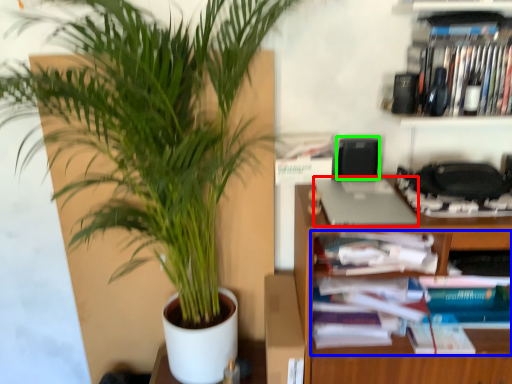
Question: Considering the real-world distances, which object is farthest from laptop (highlighted by a red box)? book (highlighted by a blue box) or speaker (highlighted by a green box)?

Choices:
 (A) book
 (B) speaker

Answer: (A)